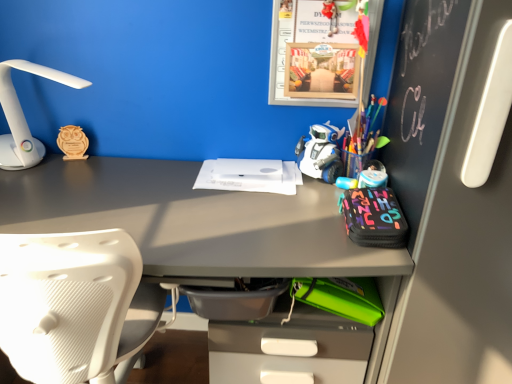
Question: From a real-world perspective, is white matte paper at center located higher than matte gray desk at center?

Choices:
 (A) yes
 (B) no

Answer: (A)

Question: Can you confirm if white matte paper at center is taller than matte gray desk at center?

Choices:
 (A) no
 (B) yes

Answer: (A)

Question: Does white matte paper at center have a lesser height compared to matte gray desk at center?

Choices:
 (A) no
 (B) yes

Answer: (B)

Question: Does white matte paper at center lie in front of matte gray desk at center?

Choices:
 (A) yes
 (B) no

Answer: (B)

Question: Are white matte paper at center and matte gray desk at center beside each other?

Choices:
 (A) yes
 (B) no

Answer: (B)

Question: Can you confirm if white matte paper at center is smaller than matte gray desk at center?

Choices:
 (A) no
 (B) yes

Answer: (B)

Question: Is matte gray desk at center not inside white plastic lamp at left?

Choices:
 (A) no
 (B) yes

Answer: (B)

Question: Is matte gray desk at center next to white plastic lamp at left?

Choices:
 (A) yes
 (B) no

Answer: (B)

Question: Could white plastic lamp at left be considered to be inside matte gray desk at center?

Choices:
 (A) yes
 (B) no

Answer: (B)

Question: Is matte gray desk at center further to camera compared to white plastic lamp at left?

Choices:
 (A) no
 (B) yes

Answer: (A)

Question: Is matte gray desk at center smaller than white plastic lamp at left?

Choices:
 (A) yes
 (B) no

Answer: (B)

Question: Is matte gray desk at center at the left side of white plastic lamp at left?

Choices:
 (A) yes
 (B) no

Answer: (B)

Question: Is wooden owl at left positioned behind white plastic robot at center?

Choices:
 (A) no
 (B) yes

Answer: (B)